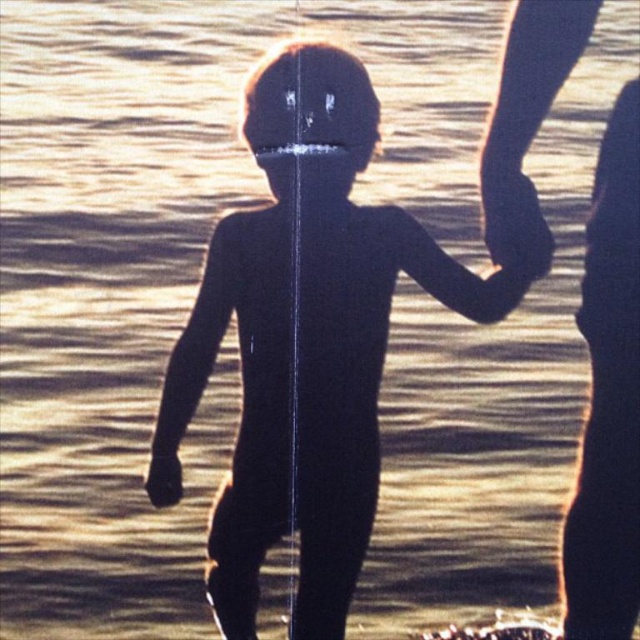
Question: Does black matte skin at center appear on the left side of black matte hand at right?

Choices:
 (A) no
 (B) yes

Answer: (B)

Question: Observing the image, what is the correct spatial positioning of black matte skin at center in reference to black matte hand at right?

Choices:
 (A) below
 (B) above

Answer: (A)

Question: Among these points, which one is farthest from the camera?

Choices:
 (A) (166, 486)
 (B) (506, 257)
 (C) (474, 307)

Answer: (C)

Question: Among these objects, which one is nearest to the camera?

Choices:
 (A) black matte hand at lower left
 (B) black matte hand at right
 (C) black matte skin at center

Answer: (C)

Question: Is black matte skin at center in front of black matte hand at right?

Choices:
 (A) no
 (B) yes

Answer: (B)

Question: Which of the following is the farthest from the observer?

Choices:
 (A) (161, 497)
 (B) (577, 560)
 (C) (374, 396)
 (D) (502, 193)

Answer: (C)